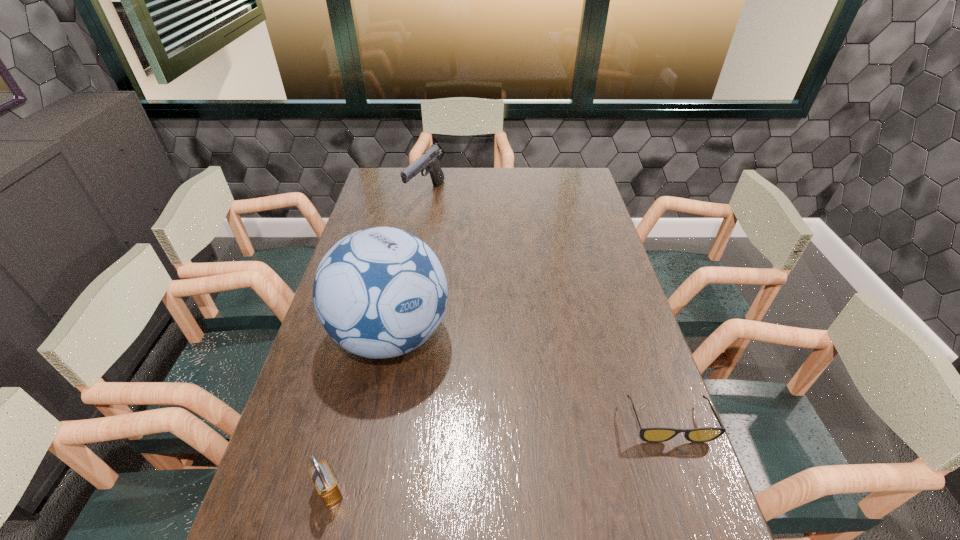
The image size is (960, 540). I want to click on free spot located at the muzzle of the gun, so click(438, 267).

Where is `free spot located at the muzzle of the gun`? This screenshot has height=540, width=960. free spot located at the muzzle of the gun is located at coordinates (438, 267).

Locate an element on the screen. vacant space situated 0.130m at the muzzle of the gun is located at coordinates (430, 232).

At what (x,y) coordinates should I click in order to perform the action: click on vacant space situated on the side with brand of the second farthest object. Please return your answer as a coordinate pair (x, y). Image resolution: width=960 pixels, height=540 pixels. Looking at the image, I should click on (456, 382).

At what (x,y) coordinates should I click in order to perform the action: click on free space located on the side with brand of the second farthest object. Please return your answer as a coordinate pair (x, y). Looking at the image, I should click on (453, 380).

In order to click on vacant area situated 0.140m on the side with brand of the second farthest object in this screenshot , I will do `click(473, 395)`.

You are a GUI agent. You are given a task and a screenshot of the screen. Output one action in this format:
    pyautogui.click(x=<x>, y=<y>)
    Task: Click on the object that is at the far edge
    This screenshot has width=960, height=540.
    Given the screenshot: What is the action you would take?
    pyautogui.click(x=430, y=160)

Image resolution: width=960 pixels, height=540 pixels. I want to click on object that is at the near edge, so [x=323, y=479].

Where is `padlock that is at the left edge`? padlock that is at the left edge is located at coordinates (323, 479).

Find the location of a particular element. This screenshot has width=960, height=540. soccer ball that is at the left edge is located at coordinates (381, 292).